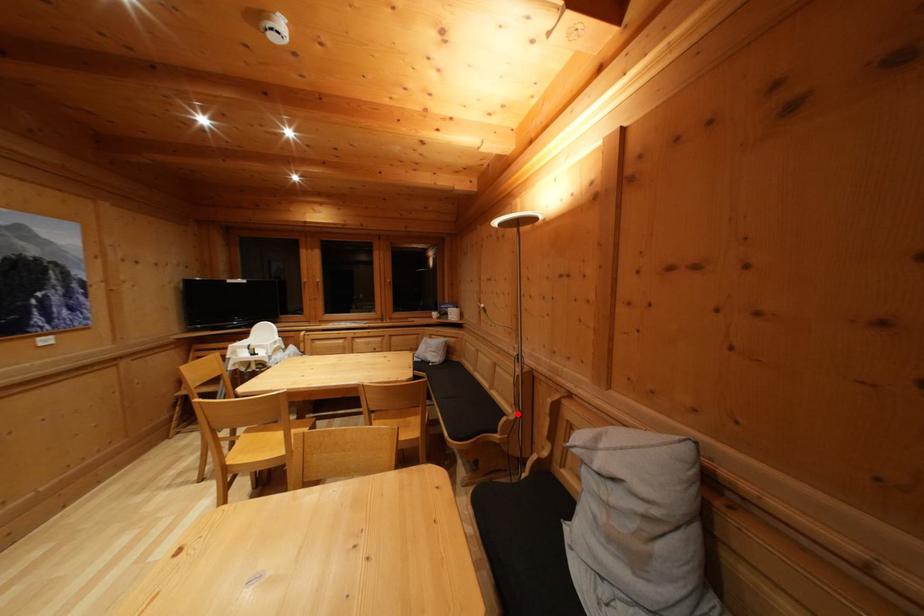
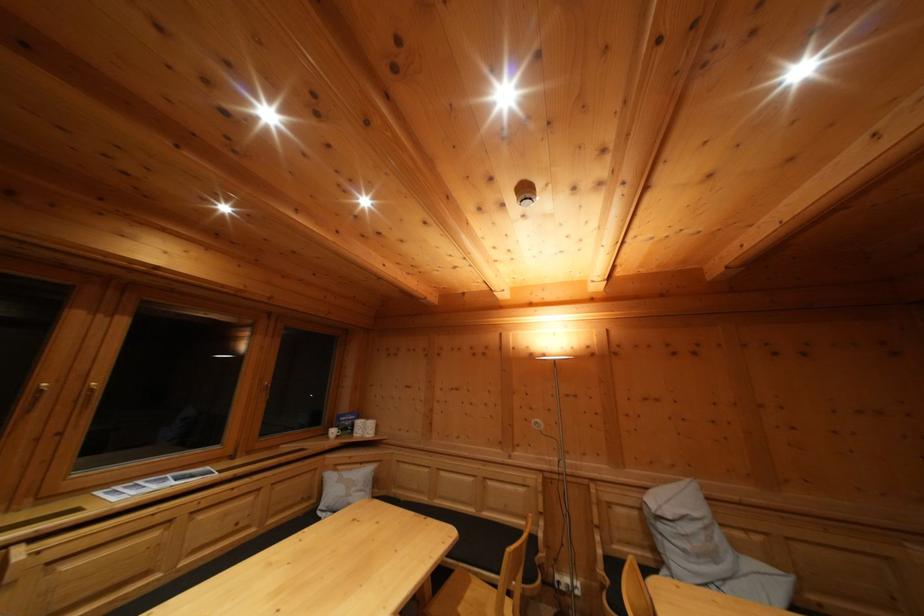
Question: I am providing you with two images of the same scene from different viewpoints. Given a red point in image1, look at the same physical point in image2. Is it:

Choices:
 (A) Closer to the viewpoint
 (B) Farther from the viewpoint

Answer: (B)